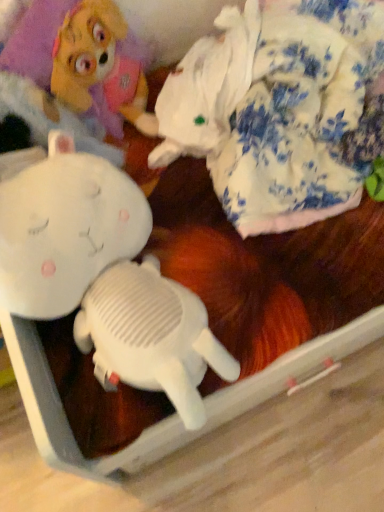
Question: Is white plush toy at center, marked as the first toy in a left-to-right arrangement, looking in the opposite direction of fluffy white blanket at upper right, which is counted as the fourth toy, starting from the left?

Choices:
 (A) no
 (B) yes

Answer: (A)

Question: Can you see white plush toy at center, positioned as the 4th toy in right-to-left order, touching fluffy white blanket at upper right, which appears as the first toy when viewed from the right?

Choices:
 (A) yes
 (B) no

Answer: (B)

Question: From the image's perspective, does white plush toy at center, marked as the first toy in a left-to-right arrangement, appear higher than fluffy white blanket at upper right, which is counted as the fourth toy, starting from the left?

Choices:
 (A) yes
 (B) no

Answer: (B)

Question: From a real-world perspective, is white plush toy at center, marked as the first toy in a left-to-right arrangement, physically below fluffy white blanket at upper right, which is counted as the fourth toy, starting from the left?

Choices:
 (A) no
 (B) yes

Answer: (A)

Question: Considering the relative sizes of white plush toy at center, marked as the first toy in a left-to-right arrangement, and fluffy white blanket at upper right, which appears as the first toy when viewed from the right, in the image provided, is white plush toy at center, marked as the first toy in a left-to-right arrangement, thinner than fluffy white blanket at upper right, which appears as the first toy when viewed from the right,?

Choices:
 (A) no
 (B) yes

Answer: (B)

Question: Is white plush toy at center, marked as the first toy in a left-to-right arrangement, smaller than fluffy white blanket at upper right, which is counted as the fourth toy, starting from the left?

Choices:
 (A) no
 (B) yes

Answer: (B)

Question: Is white plush toy at center, marked as the first toy in a left-to-right arrangement, not within white plush toy at upper left?

Choices:
 (A) no
 (B) yes

Answer: (B)

Question: Is white plush toy at center, positioned as the 4th toy in right-to-left order, bigger than white plush toy at upper left?

Choices:
 (A) no
 (B) yes

Answer: (B)

Question: From the image's perspective, is white plush toy at center, positioned as the 4th toy in right-to-left order, on top of white plush toy at upper left?

Choices:
 (A) yes
 (B) no

Answer: (B)

Question: Is white plush toy at center, positioned as the 4th toy in right-to-left order, at the left side of white plush toy at upper left?

Choices:
 (A) yes
 (B) no

Answer: (B)

Question: Is white plush toy at center, marked as the first toy in a left-to-right arrangement, turned away from white plush toy at upper left?

Choices:
 (A) no
 (B) yes

Answer: (B)

Question: Considering the relative sizes of white plush toy at center, positioned as the 4th toy in right-to-left order, and white plush toy at upper left in the image provided, is white plush toy at center, positioned as the 4th toy in right-to-left order, taller than white plush toy at upper left?

Choices:
 (A) no
 (B) yes

Answer: (A)

Question: Could you tell me if white plush rabbit at upper left, placed as the 3th toy when sorted from right to left, is facing white plush toy at upper left?

Choices:
 (A) yes
 (B) no

Answer: (B)